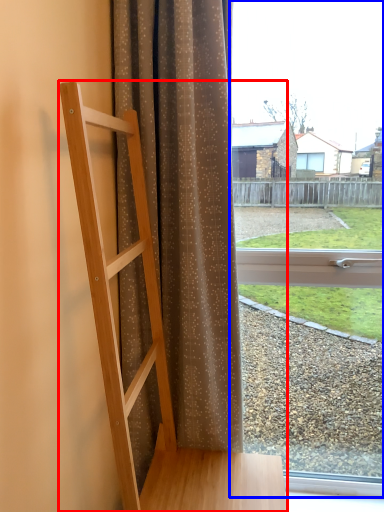
Question: Which object appears farthest to the camera in this image, furniture (highlighted by a red box) or window (highlighted by a blue box)?

Choices:
 (A) furniture
 (B) window

Answer: (B)